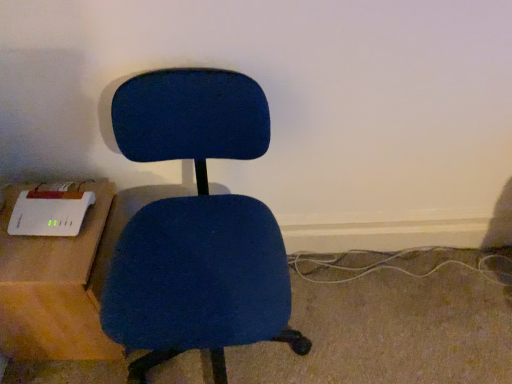
You are a GUI agent. You are given a task and a screenshot of the screen. Output one action in this format:
    pyautogui.click(x=<x>, y=<y>)
    Task: Click on the vacant space to the right of matte blue office chair at center
    The image size is (512, 384).
    Given the screenshot: What is the action you would take?
    pyautogui.click(x=373, y=312)